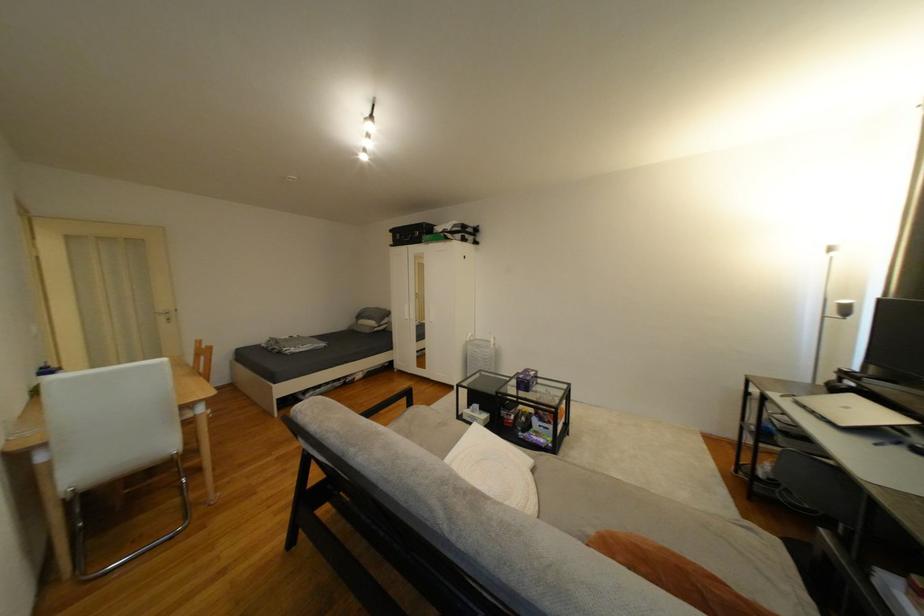
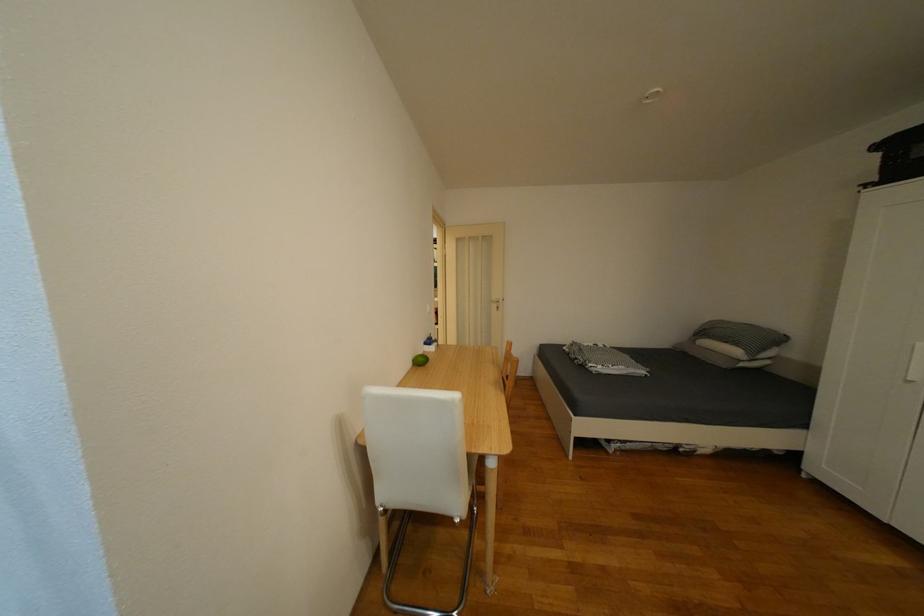
Find the pixel in the second image that matches point (169, 320) in the first image.

(503, 307)